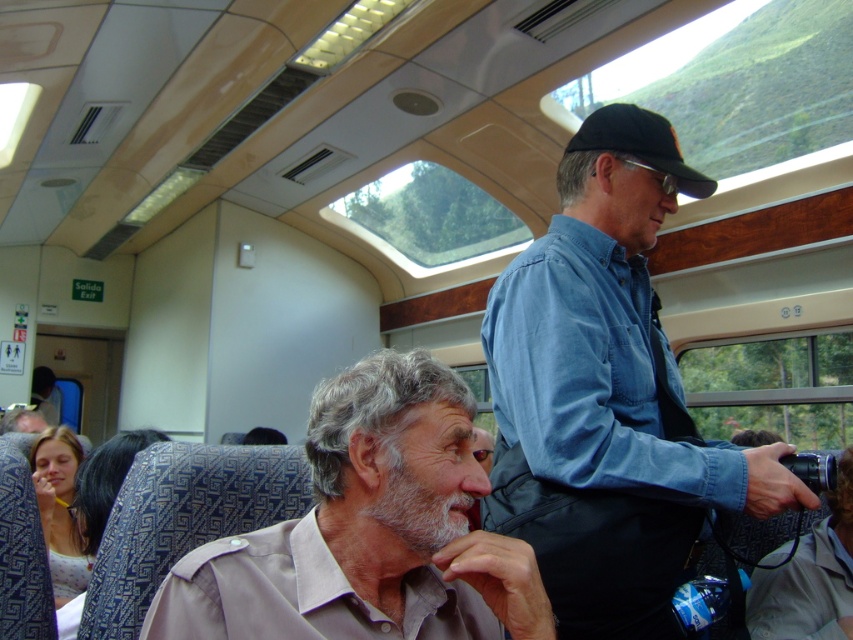
You are a passenger on this train and want to hand a book to the person wearing the blue denim shirt at upper center and the black fabric baseball cap at upper right. Which person should you approach first if you want to give the book to the one closer to you?

You should give the book to the blue denim shirt at upper center first because it is closer to you than the black fabric baseball cap at upper right.

Where is the blue denim shirt at upper center located in the image?

The blue denim shirt at upper center is located at point (608, 396) in the image.